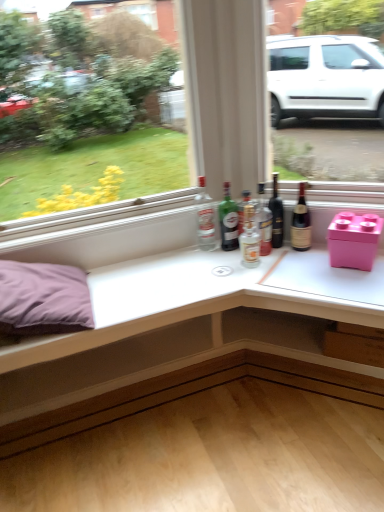
I want to click on vacant space in front of translucent glass bottle at center, acting as the 2th bottle starting from the right, so click(x=273, y=270).